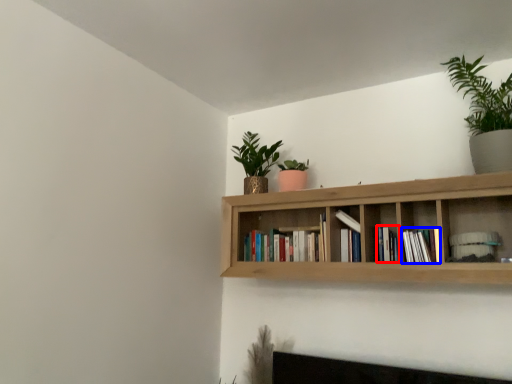
Question: Among these objects, which one is nearest to the camera, book (highlighted by a red box) or book (highlighted by a blue box)?

Choices:
 (A) book
 (B) book

Answer: (B)